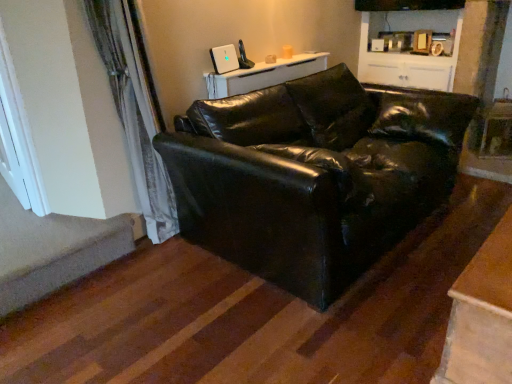
Question: Is white glossy cabinet at upper center at the left side of wooden table at lower right, which is the first table in front-to-back order?

Choices:
 (A) no
 (B) yes

Answer: (A)

Question: From the image's perspective, is white glossy cabinet at upper center above wooden table at lower right, which is the first table in front-to-back order?

Choices:
 (A) no
 (B) yes

Answer: (B)

Question: From a real-world perspective, is white glossy cabinet at upper center below wooden table at lower right, which is counted as the 2th table, starting from the back?

Choices:
 (A) no
 (B) yes

Answer: (A)

Question: Is the position of white glossy cabinet at upper center less distant than that of wooden table at lower right, which is counted as the 2th table, starting from the back?

Choices:
 (A) yes
 (B) no

Answer: (B)

Question: Is white glossy cabinet at upper center not close to wooden table at lower right, which ranks as the 1th table in right-to-left order?

Choices:
 (A) yes
 (B) no

Answer: (A)

Question: Is wooden table at lower right, which ranks as the 1th table in right-to-left order, wider or thinner than white glossy cabinet at upper center?

Choices:
 (A) thin
 (B) wide

Answer: (A)

Question: In terms of size, does wooden table at lower right, marked as the second table in a left-to-right arrangement, appear bigger or smaller than white glossy cabinet at upper center?

Choices:
 (A) small
 (B) big

Answer: (A)

Question: In the image, is wooden table at lower right, marked as the second table in a left-to-right arrangement, positioned in front of or behind white glossy cabinet at upper center?

Choices:
 (A) behind
 (B) front

Answer: (B)

Question: Is point (481, 342) positioned closer to the camera than point (428, 49)?

Choices:
 (A) closer
 (B) farther

Answer: (A)

Question: Considering the positions of white glossy table at upper center, which is counted as the first table, starting from the back, and carpeted stairwell at lower left in the image, is white glossy table at upper center, which is counted as the first table, starting from the back, bigger or smaller than carpeted stairwell at lower left?

Choices:
 (A) small
 (B) big

Answer: (A)

Question: Is point (266, 74) closer or farther from the camera than point (74, 271)?

Choices:
 (A) farther
 (B) closer

Answer: (A)

Question: Choose the correct answer: Is white glossy table at upper center, the 1th table when ordered from left to right, inside carpeted stairwell at lower left or outside it?

Choices:
 (A) outside
 (B) inside

Answer: (A)

Question: Considering the positions of white glossy table at upper center, which is counted as the first table, starting from the back, and carpeted stairwell at lower left in the image, is white glossy table at upper center, which is counted as the first table, starting from the back, wider or thinner than carpeted stairwell at lower left?

Choices:
 (A) thin
 (B) wide

Answer: (B)

Question: Is white painted wood window at left taller or shorter than black leather couch at center?

Choices:
 (A) tall
 (B) short

Answer: (B)

Question: Considering the positions of white painted wood window at left and black leather couch at center in the image, is white painted wood window at left bigger or smaller than black leather couch at center?

Choices:
 (A) big
 (B) small

Answer: (B)